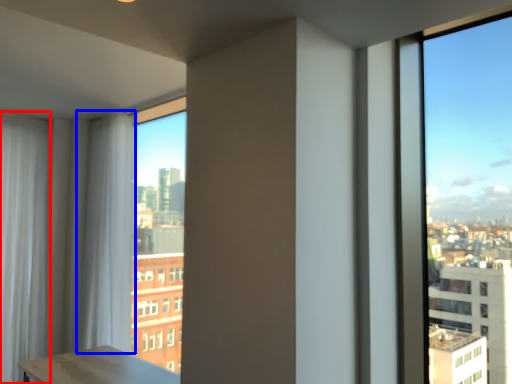
Question: Among these objects, which one is nearest to the camera, curtain (highlighted by a red box) or curtain (highlighted by a blue box)?

Choices:
 (A) curtain
 (B) curtain

Answer: (B)